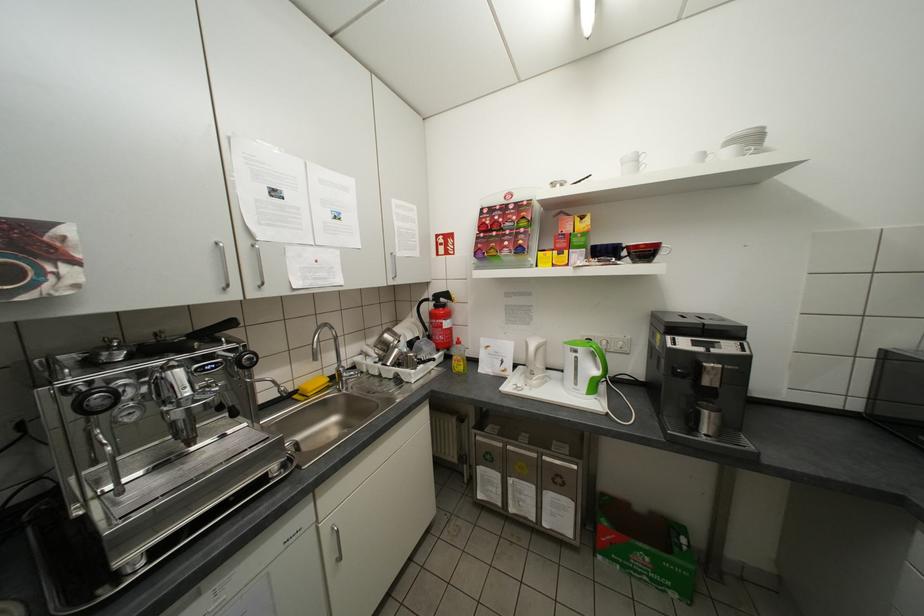
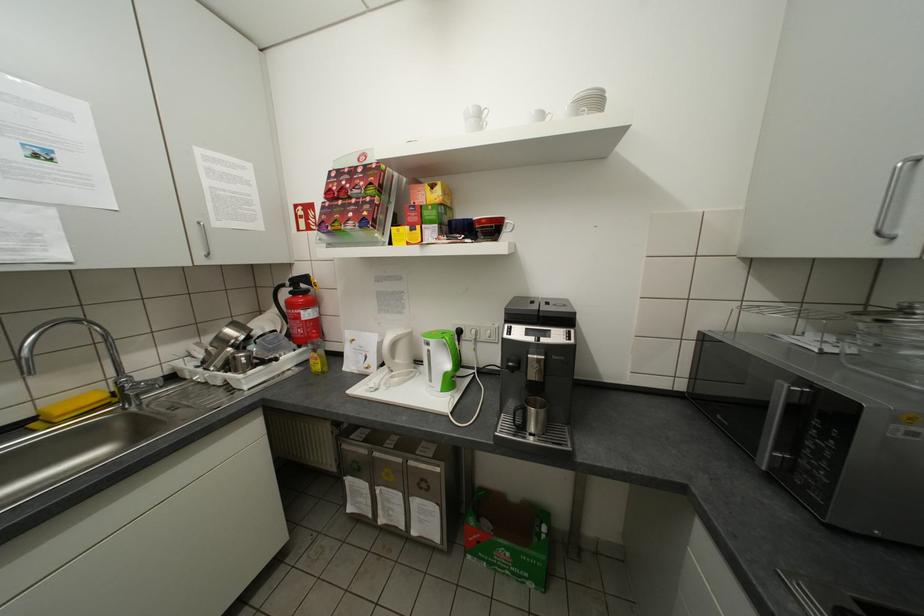
The point at (346,371) is marked in the first image. Where is the corresponding point in the second image?

(126, 383)